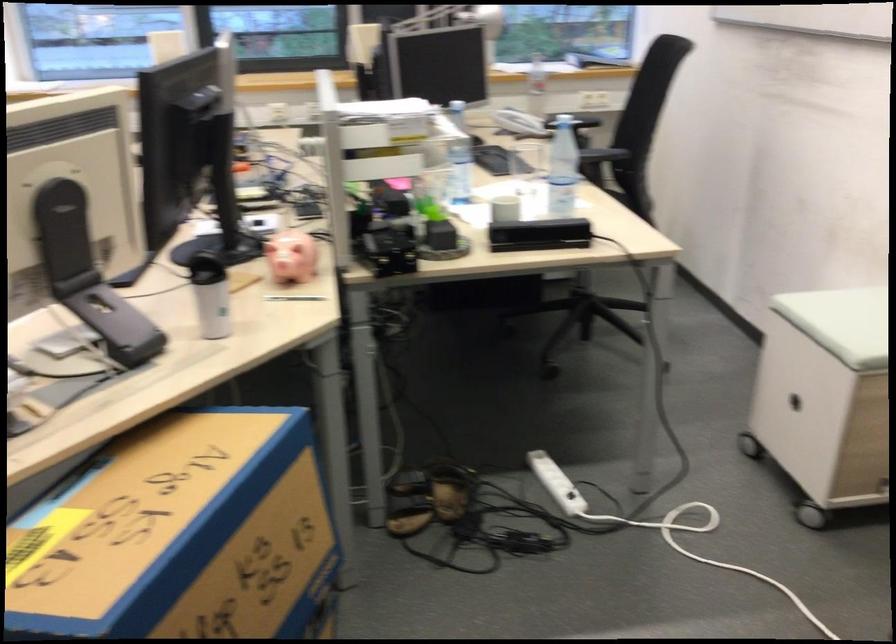
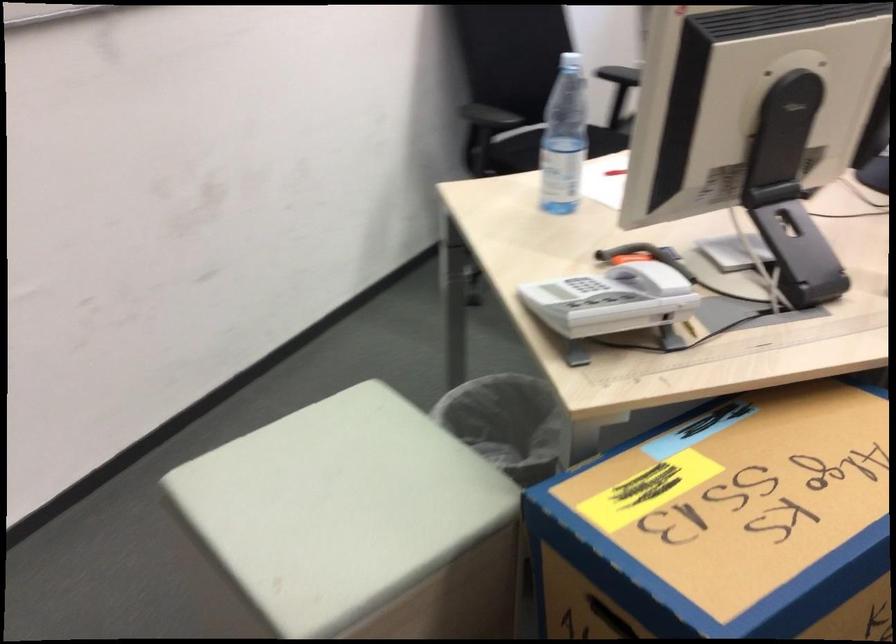
Where in the second image is the point corresponding to point (96, 404) from the first image?

(746, 334)